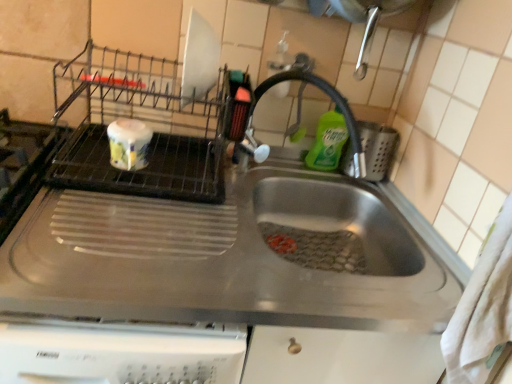
Question: From a real-world perspective, is satin nickel faucet at center physically located above or below stainless steel sink at center?

Choices:
 (A) above
 (B) below

Answer: (A)

Question: Looking at their shapes, would you say satin nickel faucet at center is wider or thinner than stainless steel sink at center?

Choices:
 (A) wide
 (B) thin

Answer: (B)

Question: Estimate the real-world distances between objects in this image. Which object is closer to the green liquid soap at upper right?

Choices:
 (A) stainless steel sink at center
 (B) satin nickel faucet at center

Answer: (B)

Question: Considering the real-world distances, which object is farthest from the satin nickel faucet at center?

Choices:
 (A) stainless steel sink at center
 (B) green liquid soap at upper right

Answer: (A)